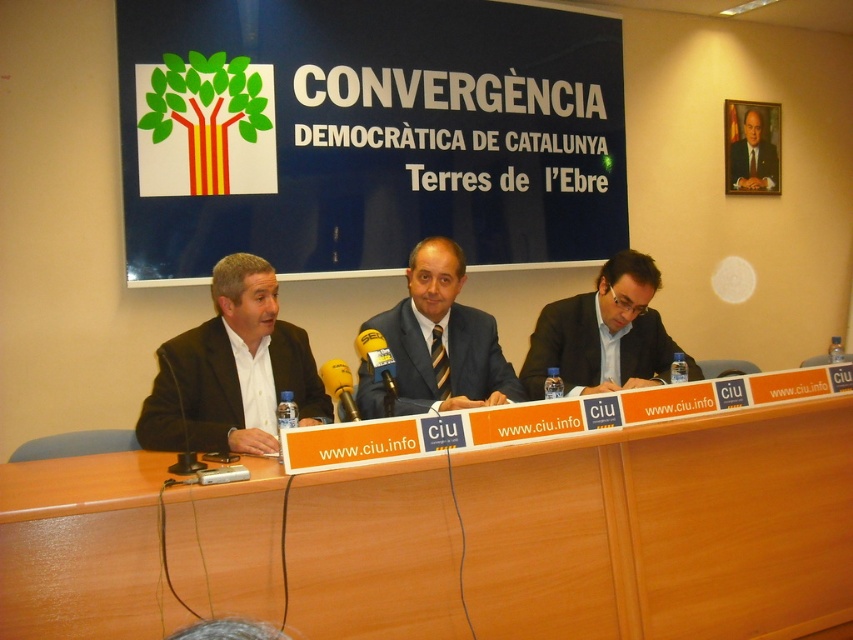
Question: Does metallic silver microphone at center appear over metallic yellow microphone at center?

Choices:
 (A) no
 (B) yes

Answer: (B)

Question: Which point is closer to the camera taking this photo?

Choices:
 (A) (395, 394)
 (B) (514, 627)
 (C) (430, 380)
 (D) (595, 131)

Answer: (B)

Question: Which object is positioned closest to the metallic yellow microphone at center?

Choices:
 (A) matte black suit at right
 (B) black plastic microphone at left
 (C) matte plastic signboard at upper center
 (D) wooden at center

Answer: (B)

Question: Is matte plastic signboard at upper center further to the viewer compared to matte black suit at right?

Choices:
 (A) no
 (B) yes

Answer: (B)

Question: Estimate the real-world distances between objects in this image. Which object is closer to the matte plastic signboard at upper center?

Choices:
 (A) matte black suit at left
 (B) wooden at center
 (C) metallic yellow microphone at center
 (D) black plastic microphone at left

Answer: (A)

Question: Is matte plastic signboard at upper center bigger than black plastic microphone at left?

Choices:
 (A) yes
 (B) no

Answer: (A)